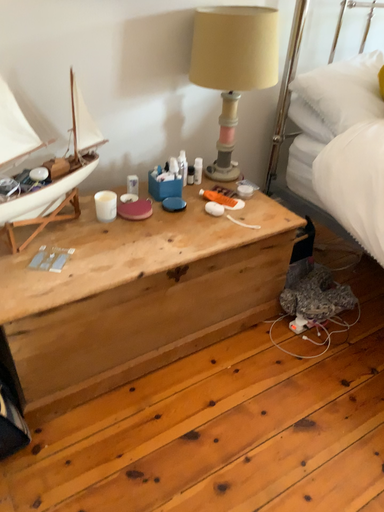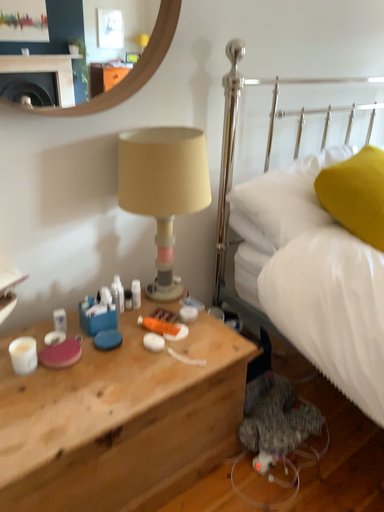
Question: Which way did the camera rotate in the video?

Choices:
 (A) rotated downward
 (B) rotated upward

Answer: (B)